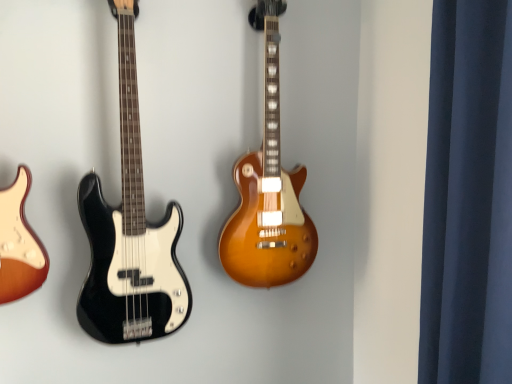
Measure the distance between point (258, 225) and camera.

The depth of point (258, 225) is 4.32 feet.

What do you see at coordinates (468, 197) in the screenshot? I see `dark blue fabric at right` at bounding box center [468, 197].

The width and height of the screenshot is (512, 384). I want to click on black glossy bass guitar at left, which is the 1th guitar from left to right, so click(130, 232).

This screenshot has width=512, height=384. I want to click on satin sunburst guitar at center, which appears as the 2th guitar when viewed from the left, so click(268, 189).

Which is more to the left, dark blue fabric at right or black glossy bass guitar at left, which is the 2th guitar in right-to-left order?

black glossy bass guitar at left, which is the 2th guitar in right-to-left order.

From a real-world perspective, is dark blue fabric at right physically located above or below black glossy bass guitar at left, which is the 2th guitar in right-to-left order?

Clearly, from a real-world perspective, dark blue fabric at right is below black glossy bass guitar at left, which is the 2th guitar in right-to-left order.

Is dark blue fabric at right placed right next to black glossy bass guitar at left, which is the 1th guitar from left to right?

dark blue fabric at right and black glossy bass guitar at left, which is the 1th guitar from left to right, are clearly separated.

From their relative heights in the image, would you say dark blue fabric at right is taller or shorter than black glossy bass guitar at left, which is the 2th guitar in right-to-left order?

In the image, dark blue fabric at right appears to be shorter than black glossy bass guitar at left, which is the 2th guitar in right-to-left order.

Which of these two, dark blue fabric at right or satin sunburst guitar at center, which is counted as the 1th guitar, starting from the right, is wider?

dark blue fabric at right is wider.

From the image's perspective, between dark blue fabric at right and satin sunburst guitar at center, which is counted as the 1th guitar, starting from the right, which one is located above?

From the image's view, satin sunburst guitar at center, which is counted as the 1th guitar, starting from the right, is above.

Which of these two, dark blue fabric at right or satin sunburst guitar at center, which is counted as the 1th guitar, starting from the right, stands taller?

satin sunburst guitar at center, which is counted as the 1th guitar, starting from the right, is taller.

In the scene shown: From the image's perspective, is satin sunburst guitar at center, which is counted as the 1th guitar, starting from the right, above black glossy bass guitar at left, which is the 1th guitar from left to right?

Yes, from the image's perspective, satin sunburst guitar at center, which is counted as the 1th guitar, starting from the right, is above black glossy bass guitar at left, which is the 1th guitar from left to right.

Could you measure the distance between satin sunburst guitar at center, which is counted as the 1th guitar, starting from the right, and black glossy bass guitar at left, which is the 2th guitar in right-to-left order?

The distance of satin sunburst guitar at center, which is counted as the 1th guitar, starting from the right, from black glossy bass guitar at left, which is the 2th guitar in right-to-left order, is 31.65 centimeters.

Is satin sunburst guitar at center, which is counted as the 1th guitar, starting from the right, facing towards black glossy bass guitar at left, which is the 1th guitar from left to right?

No, satin sunburst guitar at center, which is counted as the 1th guitar, starting from the right, does not turn towards black glossy bass guitar at left, which is the 1th guitar from left to right.

Is satin sunburst guitar at center, which appears as the 2th guitar when viewed from the left, further to the viewer compared to black glossy bass guitar at left, which is the 1th guitar from left to right?

Yes, the depth of satin sunburst guitar at center, which appears as the 2th guitar when viewed from the left, is greater than that of black glossy bass guitar at left, which is the 1th guitar from left to right.

Would you say satin sunburst guitar at center, which appears as the 2th guitar when viewed from the left, is to the left or to the right of dark blue fabric at right in the picture?

satin sunburst guitar at center, which appears as the 2th guitar when viewed from the left, is to the left of dark blue fabric at right.

From the image's perspective, is satin sunburst guitar at center, which is counted as the 1th guitar, starting from the right, positioned above or below dark blue fabric at right?

Based on their image positions, satin sunburst guitar at center, which is counted as the 1th guitar, starting from the right, is located above dark blue fabric at right.

Can you confirm if satin sunburst guitar at center, which appears as the 2th guitar when viewed from the left, is wider than dark blue fabric at right?

Incorrect, the width of satin sunburst guitar at center, which appears as the 2th guitar when viewed from the left, does not surpass that of dark blue fabric at right.

What's the angular difference between black glossy bass guitar at left, which is the 2th guitar in right-to-left order, and dark blue fabric at right's facing directions?

black glossy bass guitar at left, which is the 2th guitar in right-to-left order, and dark blue fabric at right are facing 91.9 degrees away from each other.

Can you confirm if black glossy bass guitar at left, which is the 2th guitar in right-to-left order, is shorter than dark blue fabric at right?

No.

Does black glossy bass guitar at left, which is the 1th guitar from left to right, appear on the left side of dark blue fabric at right?

Yes, black glossy bass guitar at left, which is the 1th guitar from left to right, is to the left of dark blue fabric at right.

From the image's perspective, which is below, black glossy bass guitar at left, which is the 2th guitar in right-to-left order, or dark blue fabric at right?

dark blue fabric at right appears lower in the image.

Is black glossy bass guitar at left, which is the 1th guitar from left to right, touching satin sunburst guitar at center, which appears as the 2th guitar when viewed from the left?

No, black glossy bass guitar at left, which is the 1th guitar from left to right, is not making contact with satin sunburst guitar at center, which appears as the 2th guitar when viewed from the left.

Considering the relative sizes of black glossy bass guitar at left, which is the 2th guitar in right-to-left order, and satin sunburst guitar at center, which appears as the 2th guitar when viewed from the left, in the image provided, is black glossy bass guitar at left, which is the 2th guitar in right-to-left order, shorter than satin sunburst guitar at center, which appears as the 2th guitar when viewed from the left,?

Incorrect, the height of black glossy bass guitar at left, which is the 2th guitar in right-to-left order, does not fall short of that of satin sunburst guitar at center, which appears as the 2th guitar when viewed from the left.

Between point (183, 310) and point (263, 155), which one is positioned behind?

The point (183, 310) is farther from the camera.

In order to click on guitar on the right of black glossy bass guitar at left, which is the 2th guitar in right-to-left order in this screenshot , I will do `click(268, 189)`.

Identify the location of curtain on the right of black glossy bass guitar at left, which is the 1th guitar from left to right. (468, 197).

The width and height of the screenshot is (512, 384). Identify the location of guitar that is the 2nd object above the dark blue fabric at right (from a real-world perspective). (268, 189).

Considering their positions, is black glossy bass guitar at left, which is the 2th guitar in right-to-left order, positioned closer to satin sunburst guitar at center, which appears as the 2th guitar when viewed from the left, than dark blue fabric at right?

black glossy bass guitar at left, which is the 2th guitar in right-to-left order, lies closer to satin sunburst guitar at center, which appears as the 2th guitar when viewed from the left, than the other object.

Estimate the real-world distances between objects in this image. Which object is further from black glossy bass guitar at left, which is the 2th guitar in right-to-left order, dark blue fabric at right or satin sunburst guitar at center, which is counted as the 1th guitar, starting from the right?

dark blue fabric at right is positioned further to the anchor black glossy bass guitar at left, which is the 2th guitar in right-to-left order.

Based on their spatial positions, is dark blue fabric at right or black glossy bass guitar at left, which is the 1th guitar from left to right, closer to satin sunburst guitar at center, which appears as the 2th guitar when viewed from the left?

black glossy bass guitar at left, which is the 1th guitar from left to right, is positioned closer to the anchor satin sunburst guitar at center, which appears as the 2th guitar when viewed from the left.

Considering their positions, is satin sunburst guitar at center, which appears as the 2th guitar when viewed from the left, positioned further to dark blue fabric at right than black glossy bass guitar at left, which is the 1th guitar from left to right?

black glossy bass guitar at left, which is the 1th guitar from left to right, lies further to dark blue fabric at right than the other object.

Looking at the image, which one is located further to black glossy bass guitar at left, which is the 2th guitar in right-to-left order, satin sunburst guitar at center, which is counted as the 1th guitar, starting from the right, or dark blue fabric at right?

The object further to black glossy bass guitar at left, which is the 2th guitar in right-to-left order, is dark blue fabric at right.

Based on their spatial positions, is black glossy bass guitar at left, which is the 1th guitar from left to right, or satin sunburst guitar at center, which appears as the 2th guitar when viewed from the left, closer to dark blue fabric at right?

satin sunburst guitar at center, which appears as the 2th guitar when viewed from the left.

I want to click on guitar located between black glossy bass guitar at left, which is the 2th guitar in right-to-left order, and dark blue fabric at right in the left-right direction, so click(268, 189).